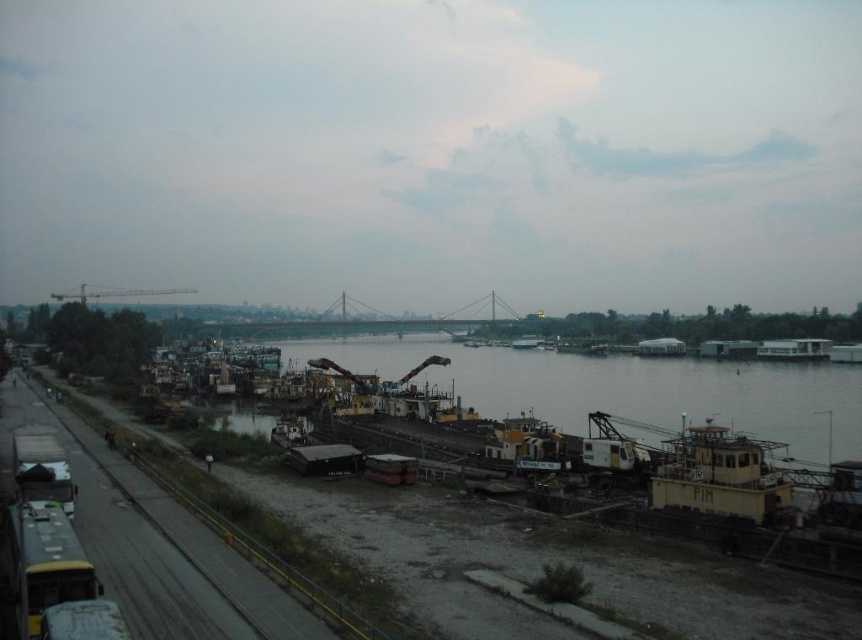
Question: Estimate the real-world distances between objects in this image. Which object is closer to the yellow metal boat at right?

Choices:
 (A) metallic gray crane at upper center
 (B) yellow matte barge at center

Answer: (B)

Question: Does metallic gray crane at upper center have a larger size compared to yellow metal boat at right?

Choices:
 (A) no
 (B) yes

Answer: (B)

Question: Does metallic gray train track at center appear under metallic gray crane at upper center?

Choices:
 (A) no
 (B) yes

Answer: (B)

Question: Which of the following is the closest to the observer?

Choices:
 (A) (132, 292)
 (B) (806, 440)
 (C) (66, 424)
 (D) (854, 346)

Answer: (C)

Question: Estimate the real-world distances between objects in this image. Which object is farther from the yellow metal boat at right?

Choices:
 (A) metallic gray train track at center
 (B) metallic yellow barge at center
 (C) yellow matte barge at center
 (D) metallic gray crane at upper center

Answer: (D)

Question: Is metallic gray train track at center positioned in front of metallic gray crane at upper center?

Choices:
 (A) yes
 (B) no

Answer: (A)